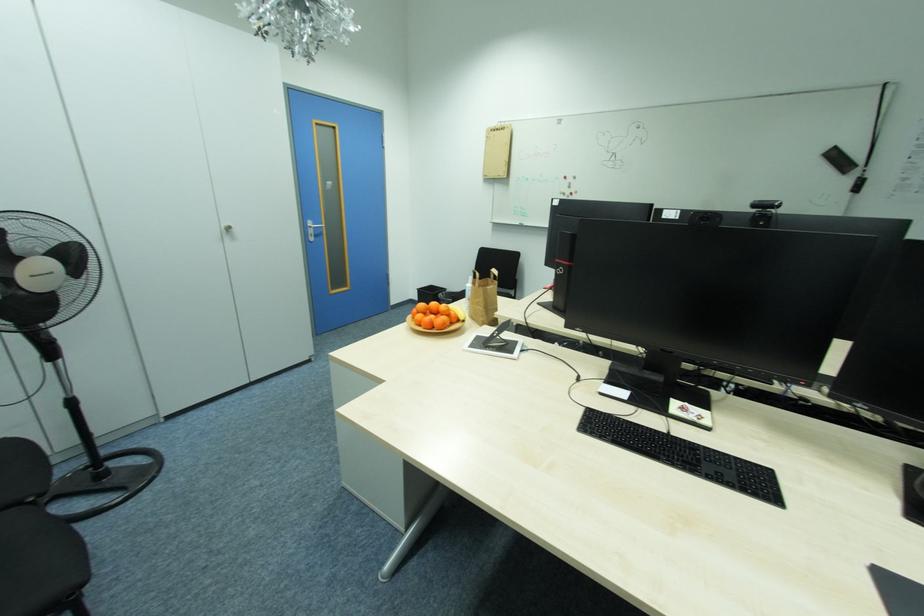
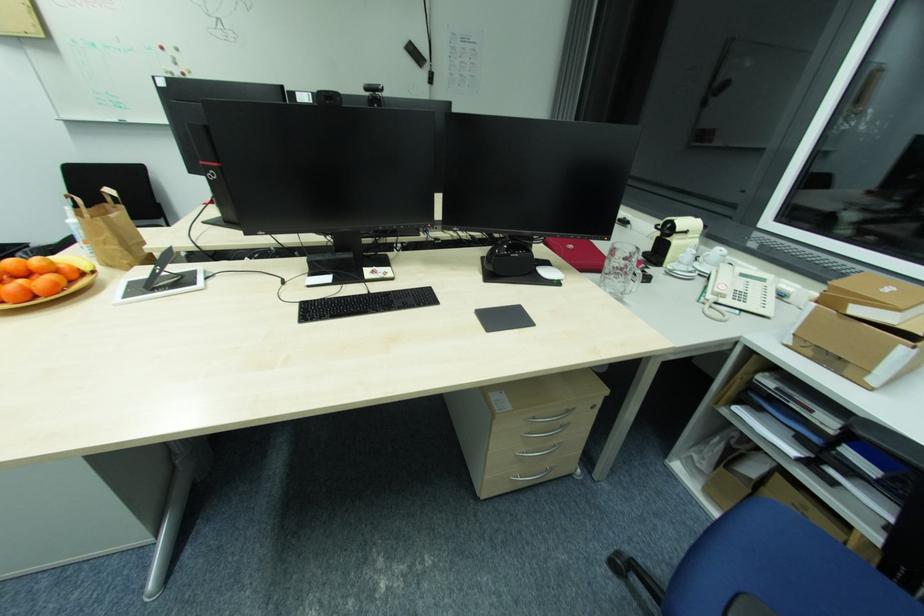
The images are taken continuously from a first-person perspective. In which direction is your viewpoint rotating?

The camera's rotation is toward right-down.